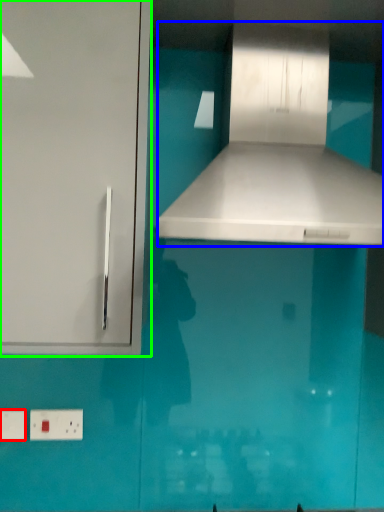
Question: Which object is positioned closest to electric outlet (highlighted by a red box)? Select from vent (highlighted by a blue box) and cabinetry (highlighted by a green box).

Choices:
 (A) vent
 (B) cabinetry

Answer: (B)